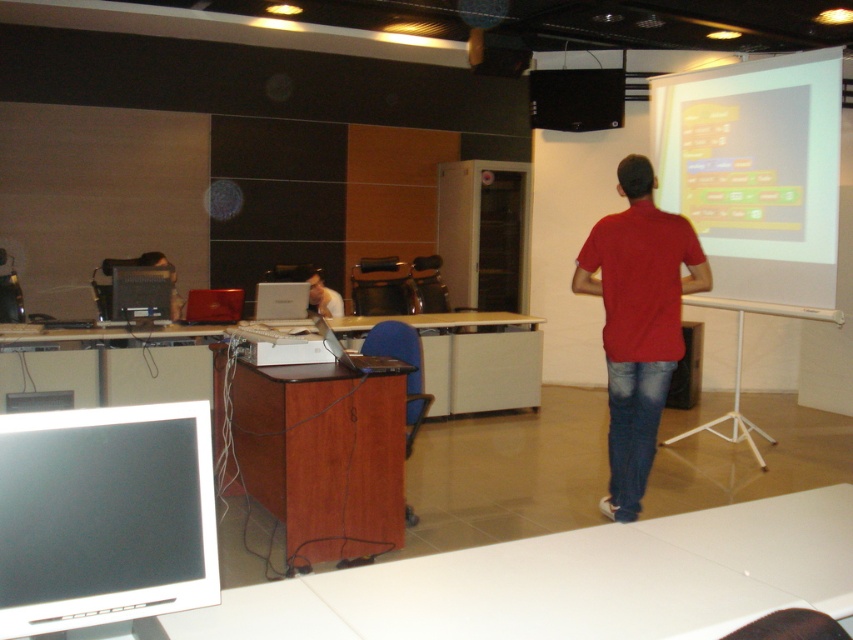
You are setting up for a presentation in the classroom. You need to connect the matte black monitor at center to the white matte projection screen at upper right. Which one should you position closer to the ceiling?

The white matte projection screen at upper right should be positioned closer to the ceiling since it is located above the matte black monitor at center.

Based on the photo, you are a student in the classroom and need to present your project using the white matte projection screen at upper right and the matte black laptop at center. Which device should you adjust first to start your presentation?

The white matte projection screen at upper right is located above the matte black laptop at center, so you should adjust the matte black laptop at center first to start the presentation.